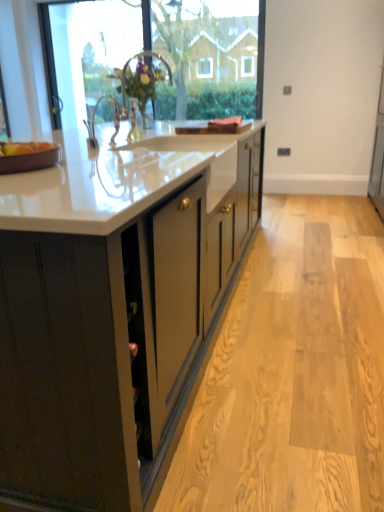
The width and height of the screenshot is (384, 512). I want to click on transparent glass door at upper left, so click(85, 52).

In order to face matte black cabinets at center, should I rotate leftwards or rightwards?

A 9.296 degree turn to the left will do.

The width and height of the screenshot is (384, 512). Identify the location of white glossy sink at upper center. [131, 91].

Which is correct: matte brown apple at left is inside white glossy sink at upper center, or outside of it?

matte brown apple at left is outside white glossy sink at upper center.

Considering the relative sizes of matte brown apple at left and white glossy sink at upper center in the image provided, is matte brown apple at left smaller than white glossy sink at upper center?

Correct, matte brown apple at left occupies less space than white glossy sink at upper center.

From the picture: Does matte brown apple at left turn towards white glossy sink at upper center?

No, matte brown apple at left does not turn towards white glossy sink at upper center.

Considering the relative positions of matte brown apple at left and white glossy sink at upper center in the image provided, is matte brown apple at left to the right of white glossy sink at upper center from the viewer's perspective?

No.

Would you say transparent glass window at upper center is inside or outside transparent glass door at upper left?

transparent glass window at upper center is outside transparent glass door at upper left.

From their relative heights in the image, would you say transparent glass window at upper center is taller or shorter than transparent glass door at upper left?

Considering their sizes, transparent glass window at upper center has less height than transparent glass door at upper left.

Is transparent glass window at upper center with transparent glass door at upper left?

transparent glass window at upper center is not next to transparent glass door at upper left, and they're not touching.

How many degrees apart are the facing directions of transparent glass window at upper center and transparent glass door at upper left?

0.966 degrees separate the facing orientations of transparent glass window at upper center and transparent glass door at upper left.

Is transparent glass window at upper center with matte black cabinets at center?

transparent glass window at upper center is not next to matte black cabinets at center, and they're not touching.

How far apart are transparent glass window at upper center and matte black cabinets at center?

transparent glass window at upper center and matte black cabinets at center are 10.27 feet apart from each other.

From the image's perspective, does transparent glass window at upper center appear higher than matte black cabinets at center?

Yes.

Would you say transparent glass window at upper center is outside matte black cabinets at center?

Yes, transparent glass window at upper center is outside of matte black cabinets at center.

How different are the orientations of white glossy sink at upper center and transparent glass window at upper center in degrees?

The facing directions of white glossy sink at upper center and transparent glass window at upper center are 89.6 degrees apart.

From a real-world perspective, between white glossy sink at upper center and transparent glass window at upper center, who is vertically lower?

white glossy sink at upper center, from a real-world perspective.

Is white glossy sink at upper center in front of or behind transparent glass window at upper center in the image?

Visually, white glossy sink at upper center is located in front of transparent glass window at upper center.

Is white glossy sink at upper center facing towards transparent glass window at upper center?

No, white glossy sink at upper center does not turn towards transparent glass window at upper center.

From a real-world perspective, relative to transparent glass door at upper left, is brown matte tray at left vertically above or below?

Clearly, from a real-world perspective, brown matte tray at left is below transparent glass door at upper left.

Locate an element on the screen. Image resolution: width=384 pixels, height=512 pixels. tray below the transparent glass door at upper left (from the image's perspective) is located at coordinates tap(30, 161).

What's the angular difference between brown matte tray at left and transparent glass door at upper left's facing directions?

The angle between the facing direction of brown matte tray at left and the facing direction of transparent glass door at upper left is 88.8 degrees.

Can you confirm if transparent glass window at upper center is positioned to the right of matte brown apple at left?

Yes.

From the image's perspective, which one is positioned lower, transparent glass window at upper center or matte brown apple at left?

matte brown apple at left appears lower in the image.

Who is bigger, transparent glass window at upper center or matte brown apple at left?

transparent glass window at upper center is bigger.

Is matte black cabinets at center positioned far away from transparent glass door at upper left?

They are positioned close to each other.

Is matte black cabinets at center further to the viewer compared to transparent glass door at upper left?

No, it is in front of transparent glass door at upper left.

Which of these two, matte black cabinets at center or transparent glass door at upper left, is wider?

matte black cabinets at center.

What's the angular difference between matte black cabinets at center and transparent glass door at upper left's facing directions?

The angular difference between matte black cabinets at center and transparent glass door at upper left is 89.1 degrees.

Locate an element on the screen. apple below the white glossy sink at upper center (from a real-world perspective) is located at coordinates (24, 148).

Locate an element on the screen. glass door on the left of transparent glass window at upper center is located at coordinates (85, 52).

Which object lies nearer to the anchor point transparent glass door at upper left, matte black cabinets at center or white glossy sink at upper center?

white glossy sink at upper center is closer to transparent glass door at upper left.

Considering their positions, is matte black cabinets at center positioned closer to brown matte tray at left than transparent glass door at upper left?

matte black cabinets at center is positioned closer to the anchor brown matte tray at left.

Considering their positions, is matte black cabinets at center positioned further to transparent glass window at upper center than matte brown apple at left?

matte brown apple at left is further to transparent glass window at upper center.

From the image, which object appears to be farther from transparent glass door at upper left, matte brown apple at left or brown matte tray at left?

brown matte tray at left is positioned further to the anchor transparent glass door at upper left.

Considering their positions, is brown matte tray at left positioned further to white glossy sink at upper center than matte brown apple at left?

Based on the image, brown matte tray at left appears to be further to white glossy sink at upper center.

From the image, which object appears to be farther from transparent glass door at upper left, white glossy sink at upper center or transparent glass window at upper center?

transparent glass window at upper center is further to transparent glass door at upper left.

Looking at the image, which one is located closer to brown matte tray at left, transparent glass door at upper left or white glossy sink at upper center?

Based on the image, white glossy sink at upper center appears to be nearer to brown matte tray at left.

When comparing their distances from white glossy sink at upper center, does transparent glass window at upper center or transparent glass door at upper left seem closer?

Based on the image, transparent glass door at upper left appears to be nearer to white glossy sink at upper center.

Identify the location of sink located between brown matte tray at left and transparent glass door at upper left in the depth direction. (131, 91).

Locate an element on the screen. The width and height of the screenshot is (384, 512). window screen between matte brown apple at left and transparent glass door at upper left from front to back is located at coordinates (210, 57).

The image size is (384, 512). Identify the location of tray between matte black cabinets at center and transparent glass door at upper left along the z-axis. (30, 161).

Image resolution: width=384 pixels, height=512 pixels. In order to click on sink positioned between matte black cabinets at center and transparent glass window at upper center from near to far in this screenshot , I will do `click(131, 91)`.